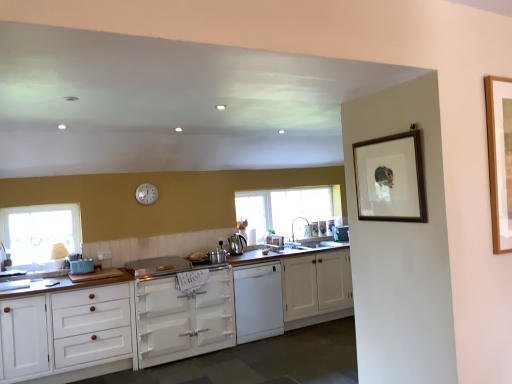
Question: In which direction should I rotate to look at white glossy sink at center, which is counted as the 5th appliance, starting from the front?

Choices:
 (A) right
 (B) left

Answer: (A)

Question: Could you tell me if clear glass window at center, arranged as the first window when viewed from the back, is turned towards white glossy sink at center, the 2th appliance in the right-to-left sequence?

Choices:
 (A) no
 (B) yes

Answer: (B)

Question: Considering the relative positions of clear glass window at center, arranged as the first window when viewed from the back, and white glossy sink at center, the first appliance in the back-to-front sequence, in the image provided, is clear glass window at center, arranged as the first window when viewed from the back, in front of white glossy sink at center, the first appliance in the back-to-front sequence,?

Choices:
 (A) yes
 (B) no

Answer: (A)

Question: Considering the relative sizes of clear glass window at center, which is the second window in front-to-back order, and white glossy sink at center, the first appliance in the back-to-front sequence, in the image provided, is clear glass window at center, which is the second window in front-to-back order, wider than white glossy sink at center, the first appliance in the back-to-front sequence,?

Choices:
 (A) yes
 (B) no

Answer: (B)

Question: Would you say clear glass window at center, arranged as the 2th window when viewed from the left, is outside white glossy sink at center, the 2th appliance in the right-to-left sequence?

Choices:
 (A) no
 (B) yes

Answer: (B)

Question: Is white glossy sink at center, the 2th appliance in the right-to-left sequence, at the back of clear glass window at center, the 1th window from the right?

Choices:
 (A) no
 (B) yes

Answer: (B)

Question: From the image's perspective, would you say clear glass window at center, which is the second window in front-to-back order, is shown under white glossy sink at center, the 2th appliance in the right-to-left sequence?

Choices:
 (A) yes
 (B) no

Answer: (B)

Question: Would you say teal matte toaster at lower left, the first appliance from the left, is outside polished stainless steel kettle at center?

Choices:
 (A) yes
 (B) no

Answer: (A)

Question: Is teal matte toaster at lower left, the first appliance from the front, wider than polished stainless steel kettle at center?

Choices:
 (A) yes
 (B) no

Answer: (A)

Question: Is teal matte toaster at lower left, the first appliance from the left, bigger than polished stainless steel kettle at center?

Choices:
 (A) yes
 (B) no

Answer: (B)

Question: Is teal matte toaster at lower left, the 6th appliance viewed from the right, behind polished stainless steel kettle at center?

Choices:
 (A) yes
 (B) no

Answer: (B)

Question: Considering the relative sizes of teal matte toaster at lower left, the first appliance from the left, and polished stainless steel kettle at center in the image provided, is teal matte toaster at lower left, the first appliance from the left, shorter than polished stainless steel kettle at center?

Choices:
 (A) no
 (B) yes

Answer: (B)

Question: Considering the relative positions of teal matte toaster at lower left, the first appliance from the left, and polished stainless steel kettle at center in the image provided, is teal matte toaster at lower left, the first appliance from the left, to the right of polished stainless steel kettle at center from the viewer's perspective?

Choices:
 (A) yes
 (B) no

Answer: (B)

Question: Considering the relative sizes of white matte oven at center, the second cabinetry in the right-to-left sequence, and satin nickel faucet at center in the image provided, is white matte oven at center, the second cabinetry in the right-to-left sequence, bigger than satin nickel faucet at center?

Choices:
 (A) no
 (B) yes

Answer: (B)